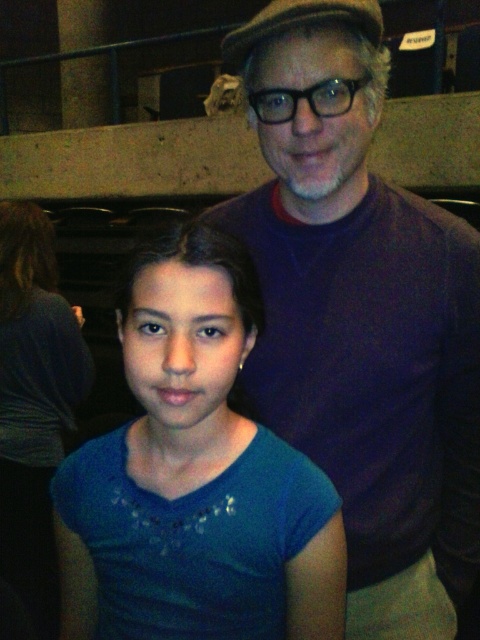
Where is the purple sweater at upper right located in the image?

The purple sweater at upper right is located at point (360, 317) in the image.

You are sitting in the theater and want to look at two points in the image. The first point is at coordinates point [238,616] and the second is at point [48,472]. Which point is closer to you?

Point [238,616] is closer to the viewer than point [48,472].

Looking at this image, you are attending a theater event and notice two people wearing blue shirts. One is wearing a blue fabric shirt at center and the other a blue cotton shirt at lower left. From your perspective, which blue shirt is located to the right of the other?

The blue fabric shirt at center is positioned to the right of the blue cotton shirt at lower left.